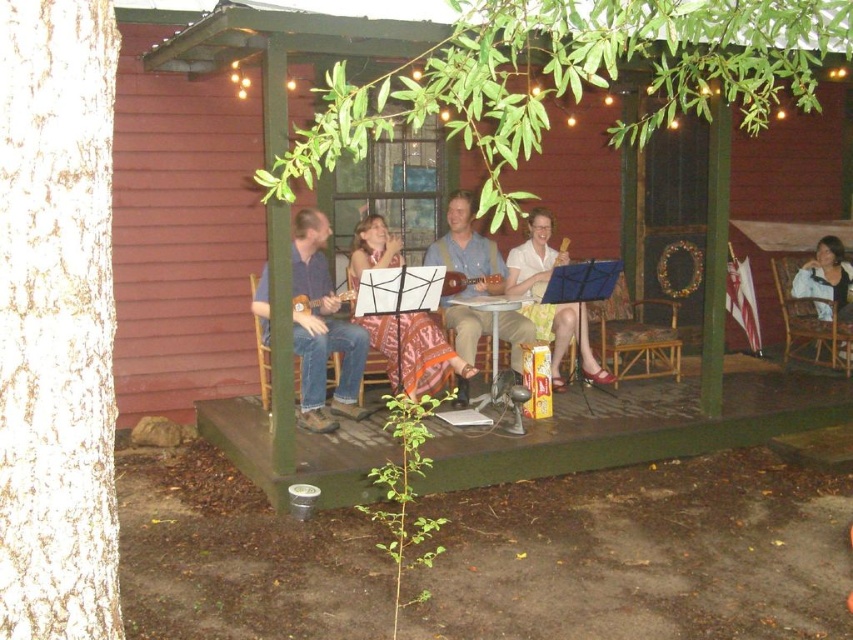
You are standing on the porch and want to place a small decoration between the two points, point (444,355) and point (664,333). Which point should you place it closer to if you want the decoration to be more visible from where you are standing?

You should place the decoration closer to point (444,355) because it is closer to the camera, making the decoration more visible from your current position.